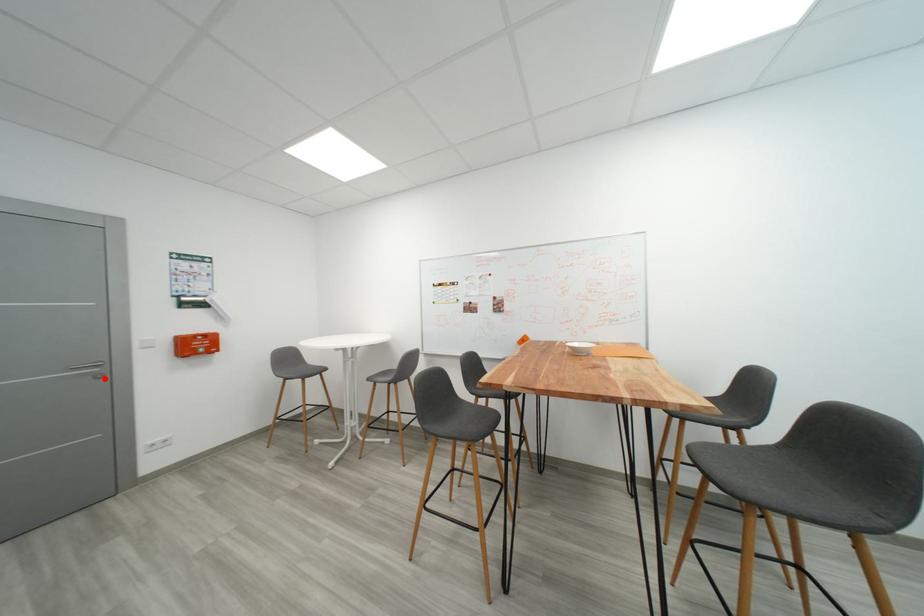
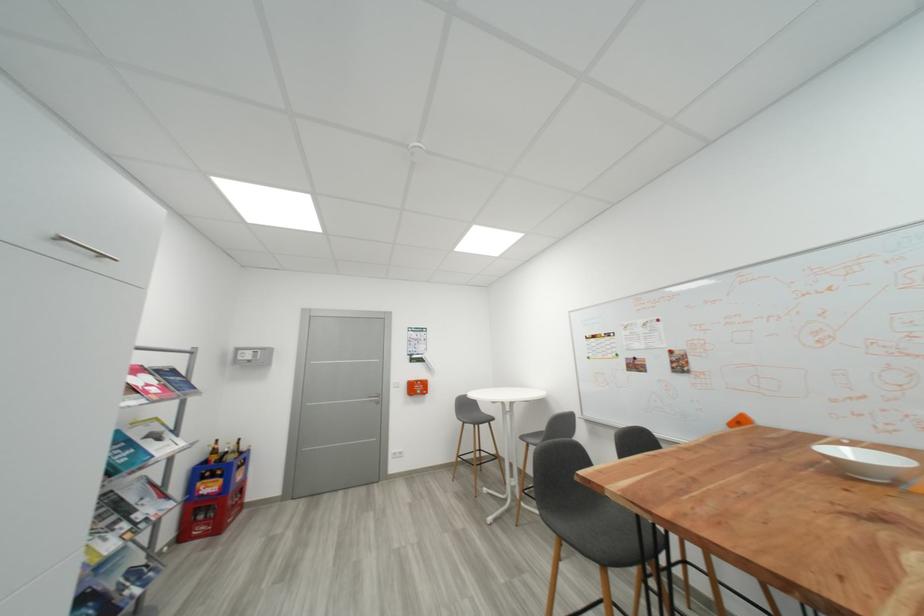
Question: I am providing you with two images of the same scene from different viewpoints. Given a red point in image1, look at the same physical point in image2. Is it:

Choices:
 (A) Closer to the viewpoint
 (B) Farther from the viewpoint

Answer: (B)